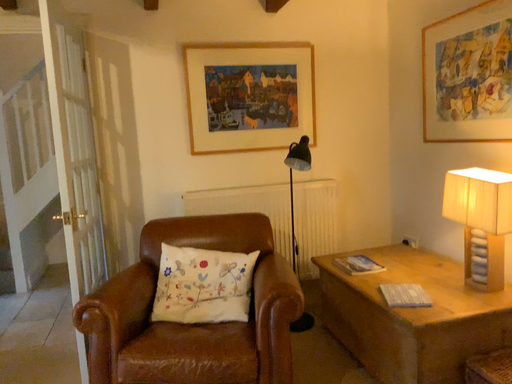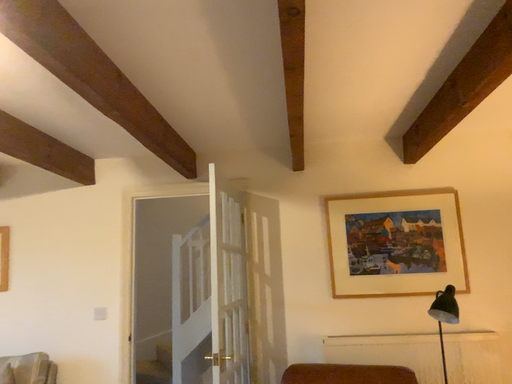
Question: How did the camera likely rotate when shooting the video?

Choices:
 (A) rotated left
 (B) rotated right

Answer: (A)